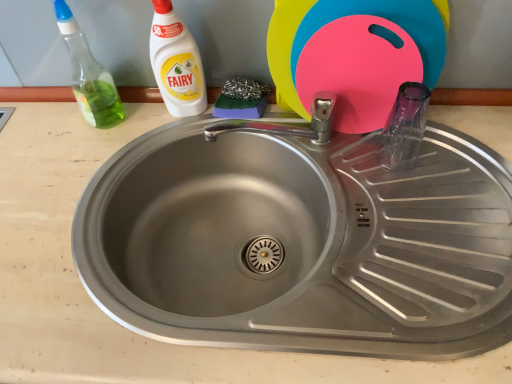
I want to click on free space in front of white plastic bottle at upper left, placed as the 2th cleaning product when sorted from left to right, so click(146, 158).